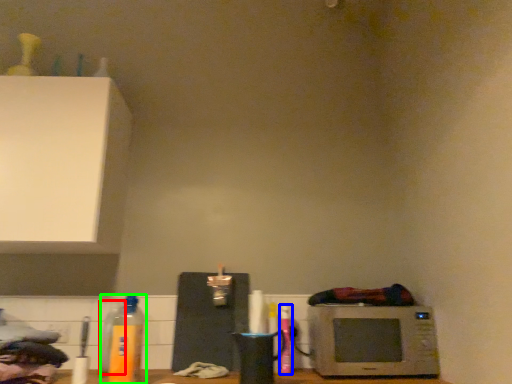
Question: Estimate the real-world distances between objects in this image. Which object is closer to bottle (highlighted by a red box), bottle (highlighted by a blue box) or bottle (highlighted by a green box)?

Choices:
 (A) bottle
 (B) bottle

Answer: (B)